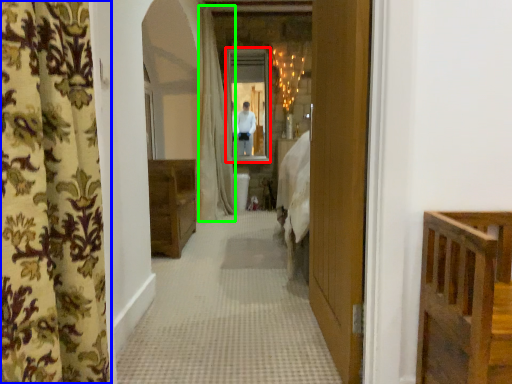
Question: Which object is the closest to the mirror (highlighted by a red box)? Choose among these: curtain (highlighted by a blue box) or shower curtain (highlighted by a green box).

Choices:
 (A) curtain
 (B) shower curtain

Answer: (B)